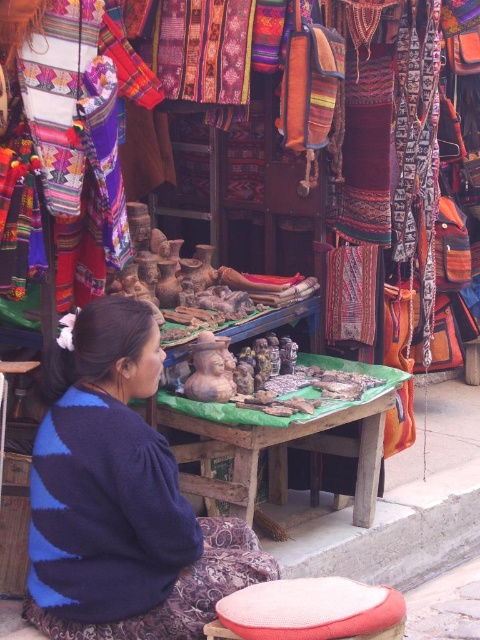
You are a customer at this market and want to buy both the blue striped sweater at center and the red woven stool at lower center. However, you have a small car trunk. Which item should you place first in the trunk to maximize space efficiency?

The red woven stool at lower center is shorter than the blue striped sweater at center, so placing the taller sweater first would allow you to stack the stool on top, maximizing space efficiency.

You are a tailor at the market and need to know which item is wider between the blue striped sweater at center and the red woven stool at lower center. Can you determine this?

The blue striped sweater at center is wider than the red woven stool at lower center.

Please provide the coordinates of the blue striped sweater at center in the image.

The coordinates of the blue striped sweater at center are at point (120, 499).